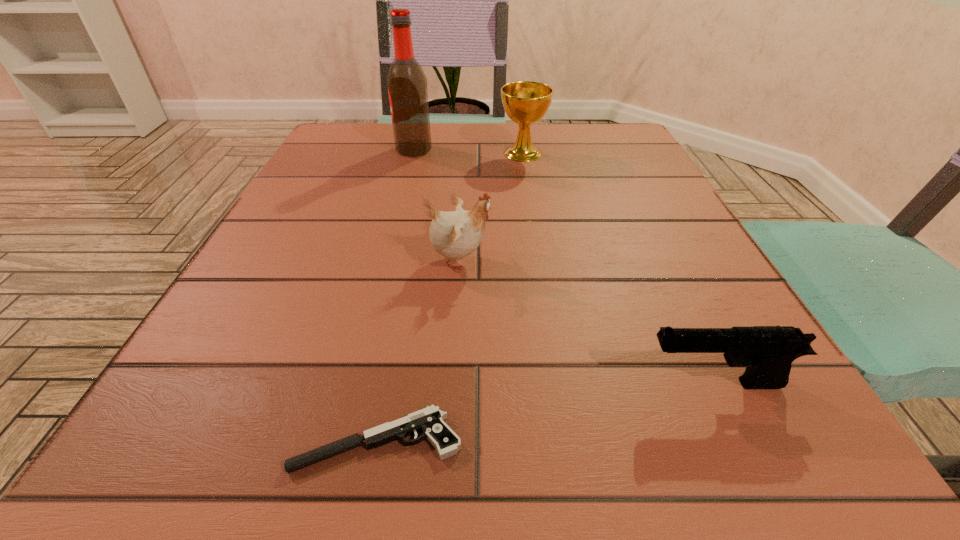
You are a GUI agent. You are given a task and a screenshot of the screen. Output one action in this format:
    pyautogui.click(x=<x>, y=<y>)
    Task: Click on the vacant area that lies between the left pistol and the third nearest object
    Image resolution: width=960 pixels, height=540 pixels.
    Given the screenshot: What is the action you would take?
    pyautogui.click(x=419, y=351)

The height and width of the screenshot is (540, 960). Find the location of `free point between the shortest object and the tallest object`. free point between the shortest object and the tallest object is located at coordinates (396, 295).

This screenshot has height=540, width=960. Find the location of `vacant region between the shortest object and the beer bottle`. vacant region between the shortest object and the beer bottle is located at coordinates (396, 295).

At what (x,y) coordinates should I click in order to perform the action: click on vacant space in between the tallest object and the third nearest object. Please return your answer as a coordinate pair (x, y). The width and height of the screenshot is (960, 540). Looking at the image, I should click on (437, 205).

Image resolution: width=960 pixels, height=540 pixels. I want to click on blank region between the second object from right to left and the nearest object, so click(450, 297).

This screenshot has height=540, width=960. I want to click on free area in between the right pistol and the shorter pistol, so click(x=547, y=412).

Where is `free space between the bird and the fourth object from left to right`? free space between the bird and the fourth object from left to right is located at coordinates (492, 207).

Find the location of a particular element. The image size is (960, 540). vacant area that lies between the second nearest object and the beer bottle is located at coordinates (564, 267).

Locate which object ranks second in proximity to the chalice. Please provide its 2D coordinates. Your answer should be formatted as a tuple, i.e. [(x, y)], where the tuple contains the x and y coordinates of a point satisfying the conditions above.

[(456, 234)]

Locate an element on the screen. object that is the closest to the nearest object is located at coordinates (456, 234).